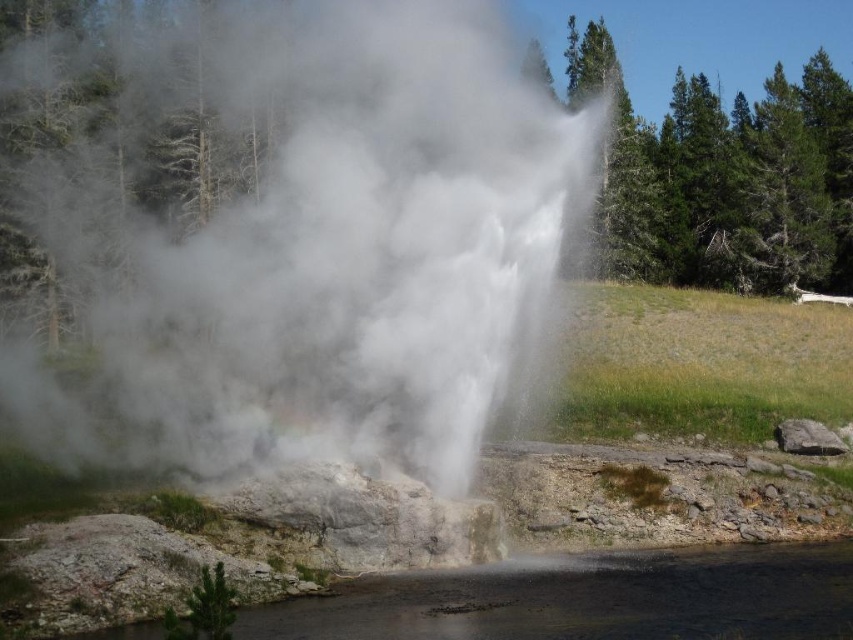
You are a park ranger assessing safety distances for visitors. The geyser is active, and you need to ensure visitors stay at least 10 meters away from the clear water at lower center. Based on the image, is the white vapor at center within the required safety zone?

The white vapor at center and clear water at lower center are 9.97 meters apart. Since the required distance is 10 meters, the white vapor at center is just inside the safety zone, meaning visitors near it would be slightly closer than the required distance.

You are a photographer trying to capture the geyser and its surroundings. You notice the white vapor at center and the clear water at lower center. Which object is located to the left of the other?

The white vapor at center is positioned on the left side of clear water at lower center.

You are standing at the point marked as point (326, 196), and you want to take a photo of the geyser. The camera you are using has a focal length of 24mm. To capture the entire geyser in the frame, what is the minimum distance you need to move away from the current position?

The point (326, 196) is 16.69 meters away from the camera. To capture the entire geyser in the frame with a 24mm focal length, you need to ensure the camera is positioned at least 16.69 meters away from the point (326, 196).